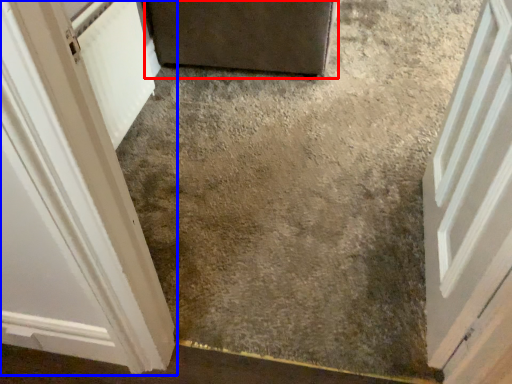
Question: Which of the following is the farthest to the observer, door (highlighted by a red box) or door (highlighted by a blue box)?

Choices:
 (A) door
 (B) door

Answer: (A)